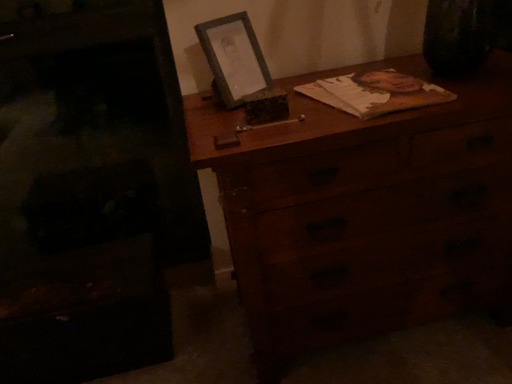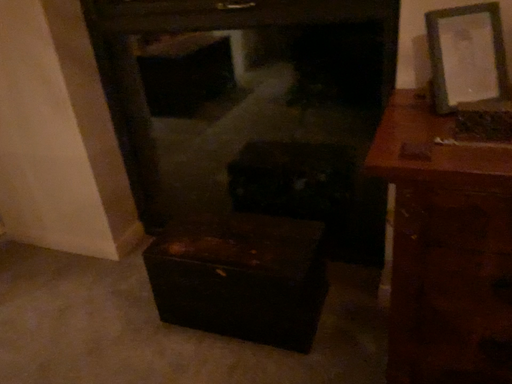
Question: Which way did the camera rotate in the video?

Choices:
 (A) rotated left
 (B) rotated right

Answer: (A)